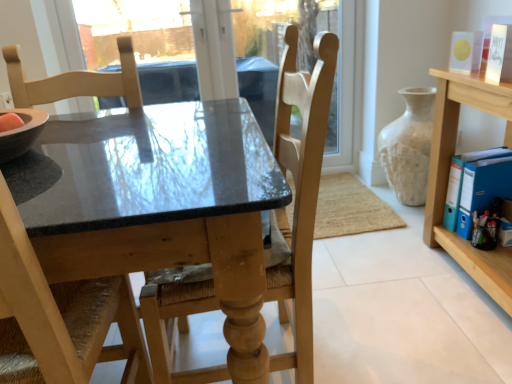
Question: Should I look upward or downward to see light wood chair at left, the 2th chair when ordered from right to left?

Choices:
 (A) up
 (B) down

Answer: (B)

Question: Is light wood shelf at right next to white textured vase at right and touching it?

Choices:
 (A) yes
 (B) no

Answer: (B)

Question: Considering the relative sizes of light wood shelf at right and white textured vase at right in the image provided, is light wood shelf at right wider than white textured vase at right?

Choices:
 (A) yes
 (B) no

Answer: (A)

Question: From a real-world perspective, is light wood shelf at right located higher than white textured vase at right?

Choices:
 (A) no
 (B) yes

Answer: (B)

Question: Does light wood shelf at right come behind white textured vase at right?

Choices:
 (A) yes
 (B) no

Answer: (B)

Question: Can you confirm if light wood shelf at right is taller than white textured vase at right?

Choices:
 (A) yes
 (B) no

Answer: (A)

Question: Could you tell me if light wood shelf at right is turned towards white textured vase at right?

Choices:
 (A) no
 (B) yes

Answer: (A)

Question: Is matte black table at center facing away from white textured vase at right?

Choices:
 (A) yes
 (B) no

Answer: (B)

Question: Is white textured vase at right a part of matte black table at center?

Choices:
 (A) no
 (B) yes

Answer: (A)

Question: Is matte black table at center not near white textured vase at right?

Choices:
 (A) yes
 (B) no

Answer: (A)

Question: Does matte black table at center appear on the right side of white textured vase at right?

Choices:
 (A) yes
 (B) no

Answer: (B)

Question: Is matte black table at center to the left of white textured vase at right from the viewer's perspective?

Choices:
 (A) no
 (B) yes

Answer: (B)

Question: Considering the relative sizes of matte black table at center and white textured vase at right in the image provided, is matte black table at center taller than white textured vase at right?

Choices:
 (A) no
 (B) yes

Answer: (B)

Question: Is light wood shelf at right inside white textured vase at right?

Choices:
 (A) yes
 (B) no

Answer: (B)